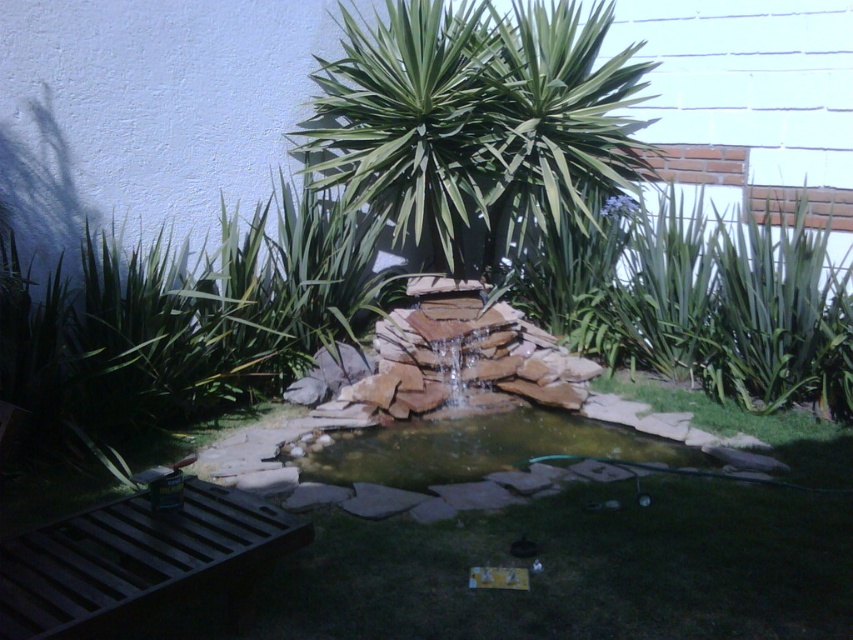
Question: Which point is closer to the camera taking this photo?

Choices:
 (A) (444, 72)
 (B) (428, 461)

Answer: (B)

Question: Which of the following is the closest to the observer?

Choices:
 (A) green leafy palm tree at center
 (B) brown stone pond at center

Answer: (B)

Question: Does green leafy palm tree at center have a lesser width compared to brown stone pond at center?

Choices:
 (A) no
 (B) yes

Answer: (A)

Question: Observing the image, what is the correct spatial positioning of green leafy palm tree at center in reference to brown stone pond at center?

Choices:
 (A) below
 (B) above

Answer: (B)

Question: Which of the following is the closest to the observer?

Choices:
 (A) (589, 422)
 (B) (468, 156)

Answer: (A)

Question: Is green leafy palm tree at center closer to the viewer compared to brown stone pond at center?

Choices:
 (A) no
 (B) yes

Answer: (A)